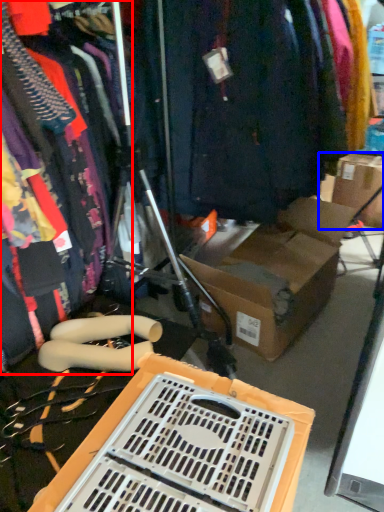
Question: Which point is further to the camera, clothing (highlighted by a red box) or cardboard box (highlighted by a blue box)?

Choices:
 (A) clothing
 (B) cardboard box

Answer: (B)